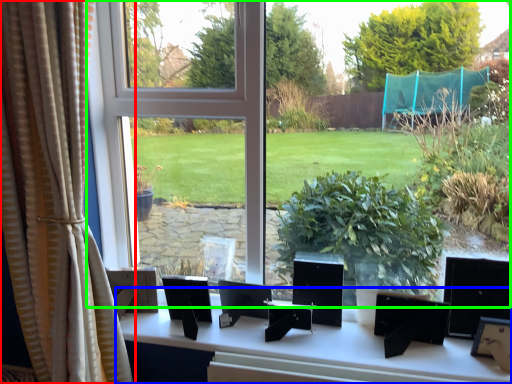
Question: Based on their relative distances, which object is nearer to curtain (highlighted by a red box)? Choose from table (highlighted by a blue box) and window (highlighted by a green box).

Choices:
 (A) table
 (B) window

Answer: (A)